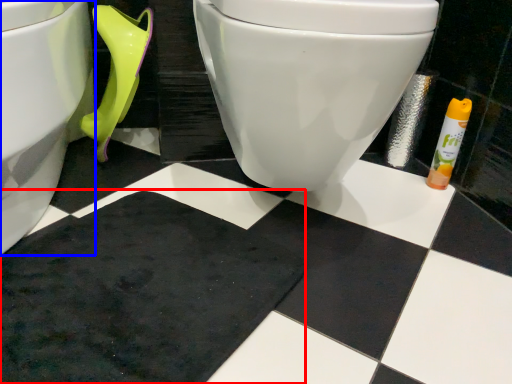
Question: Which of the following is the farthest to the observer, bath mat (highlighted by a red box) or toilet (highlighted by a blue box)?

Choices:
 (A) bath mat
 (B) toilet

Answer: (A)